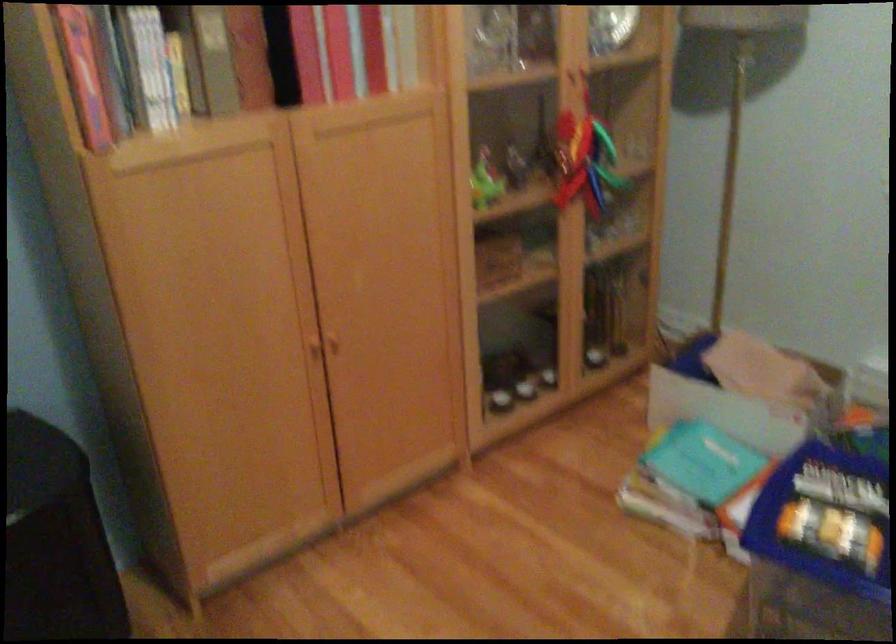
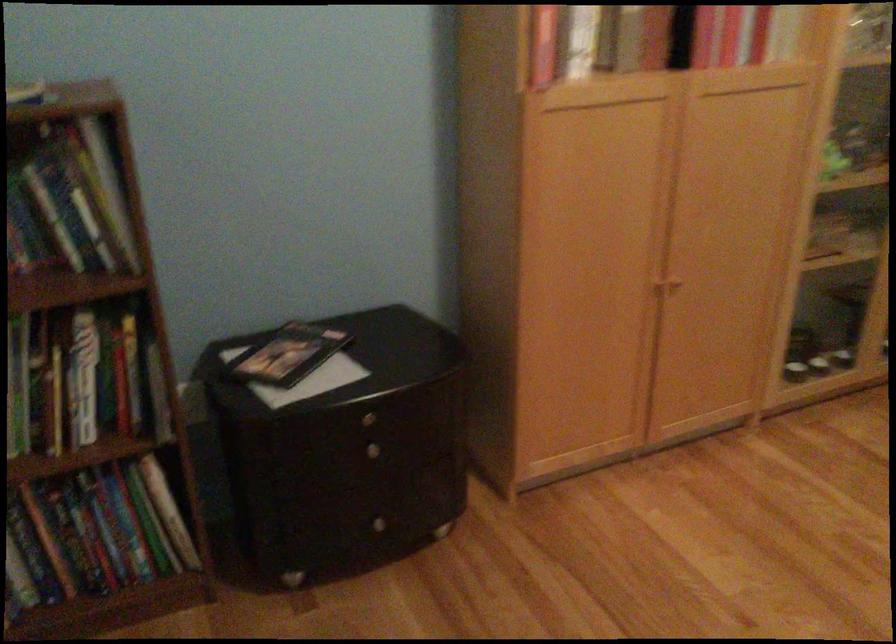
In the second image, find the point that corresponds to [330,348] in the first image.

(666, 289)